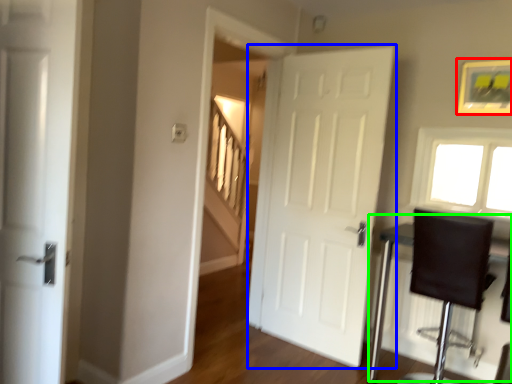
Question: Estimate the real-world distances between objects in this image. Which object is farther from picture frame (highlighted by a red box), door (highlighted by a blue box) or table (highlighted by a green box)?

Choices:
 (A) door
 (B) table

Answer: (B)